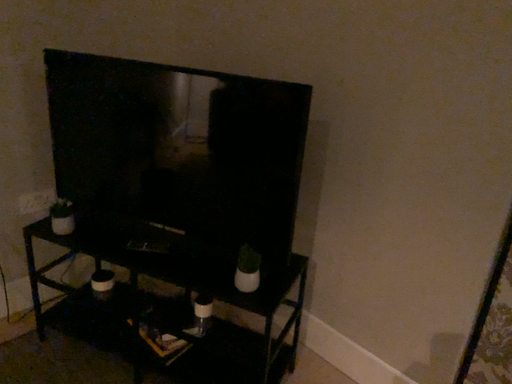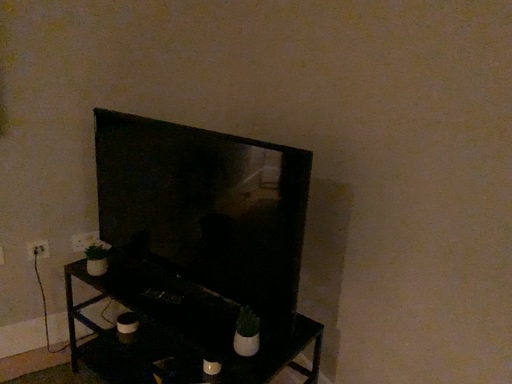
Question: Which way did the camera rotate in the video?

Choices:
 (A) rotated left
 (B) rotated right

Answer: (A)